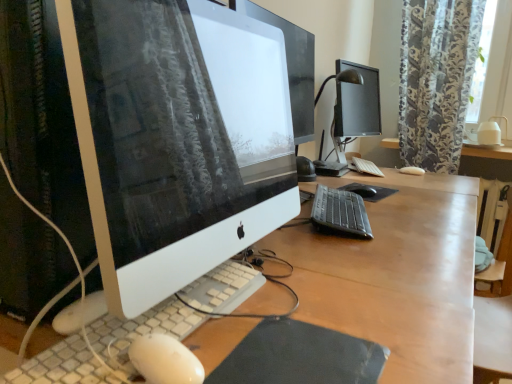
In order to click on free point below black matte mousepad at lower center, arranged as the first mousepad when ordered from the bottom (from a real-world perspective) in this screenshot , I will do `click(297, 360)`.